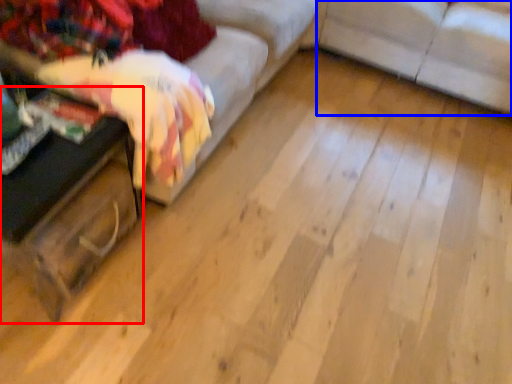
Question: Among these objects, which one is farthest to the camera, table (highlighted by a red box) or studio couch (highlighted by a blue box)?

Choices:
 (A) table
 (B) studio couch

Answer: (B)